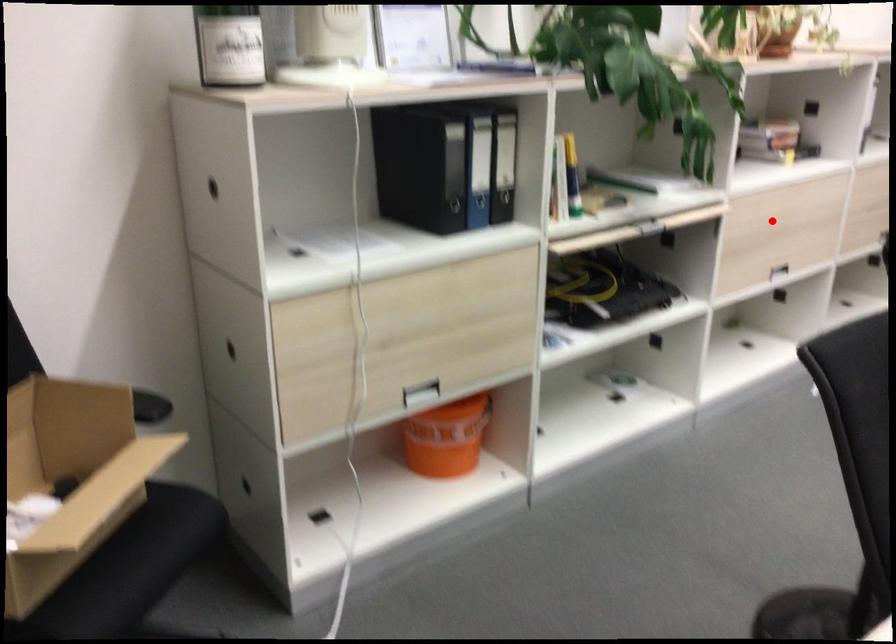
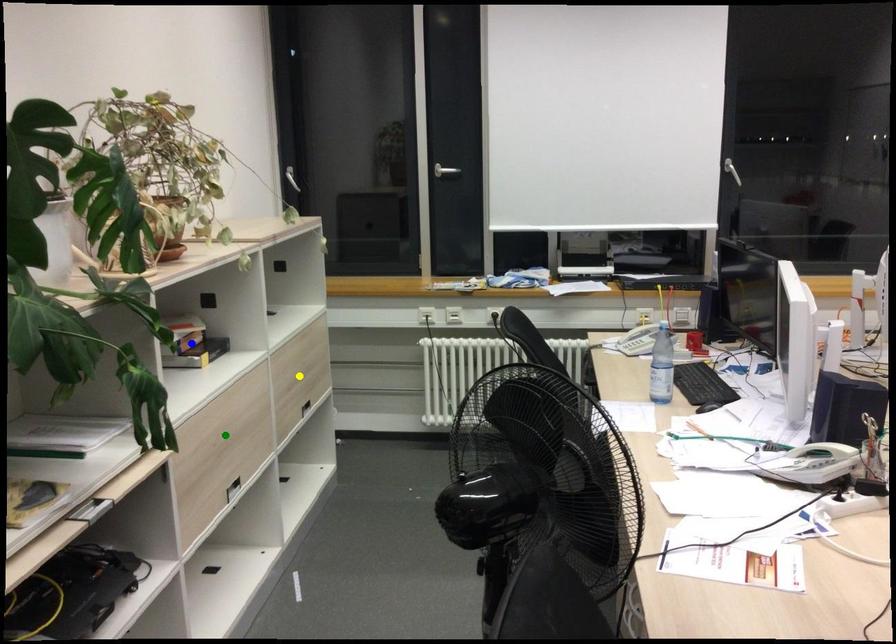
Question: I am providing you with two images of the same scene from different viewpoints. A red point is marked on the first image. You are given multiple points on the second image. Which mark in image 2 goes with the point in image 1?

Choices:
 (A) green point
 (B) yellow point
 (C) blue point

Answer: (A)